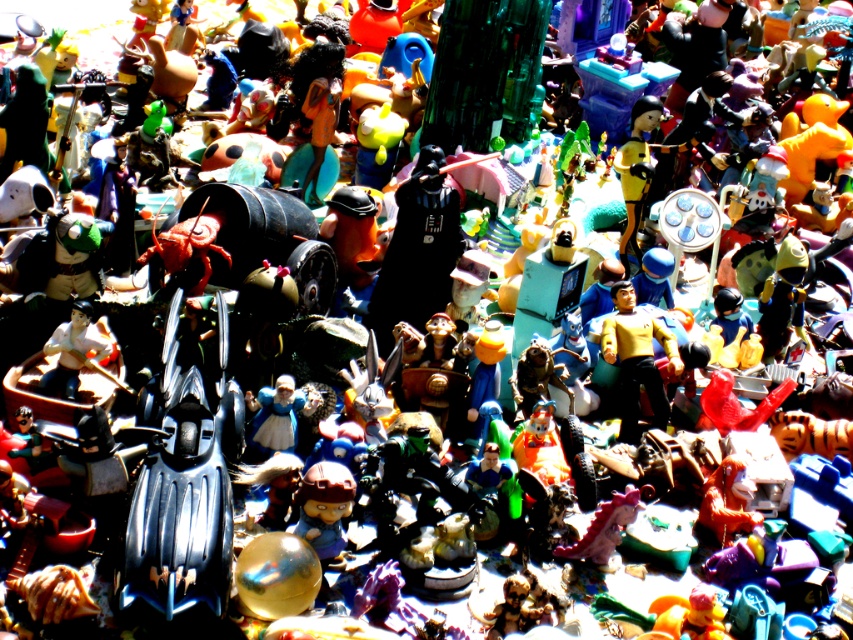
Is point (643, 333) positioned behind point (325, 547)?

Yes, it is.

From the picture: Can you confirm if yellow matte starship at center is wider than matte brown figurine at center?

Yes.

Which is behind, point (654, 417) or point (335, 481)?

The point (654, 417) is more distant.

The height and width of the screenshot is (640, 853). I want to click on yellow matte starship at center, so click(636, 358).